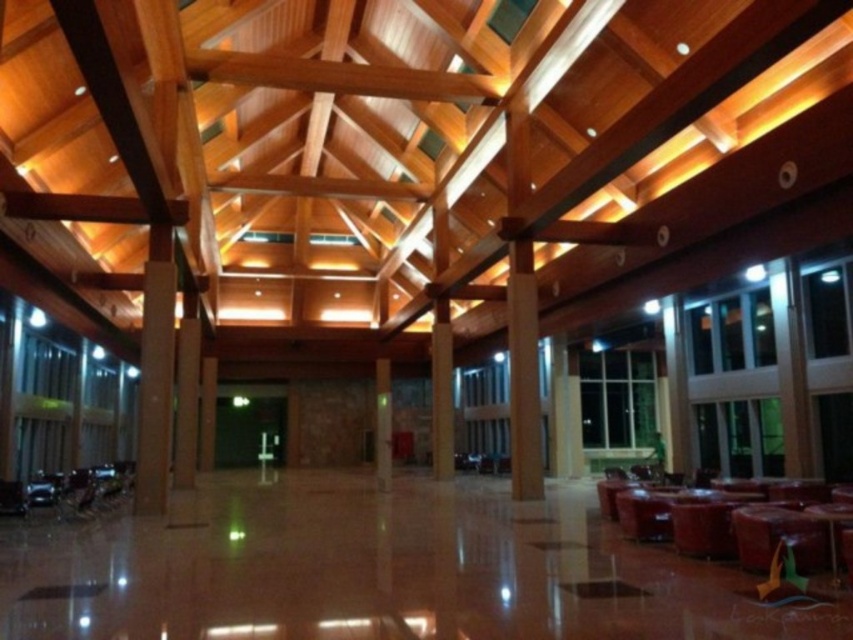
From the picture: You are standing in the lobby and want to walk straight ahead towards the entrance. Which pillar will you encounter first, the smooth stone pillar at center or the brown polished pillar at center?

The smooth stone pillar at center is in front of the brown polished pillar at center, so you will encounter the smooth stone pillar at center first when walking straight ahead.